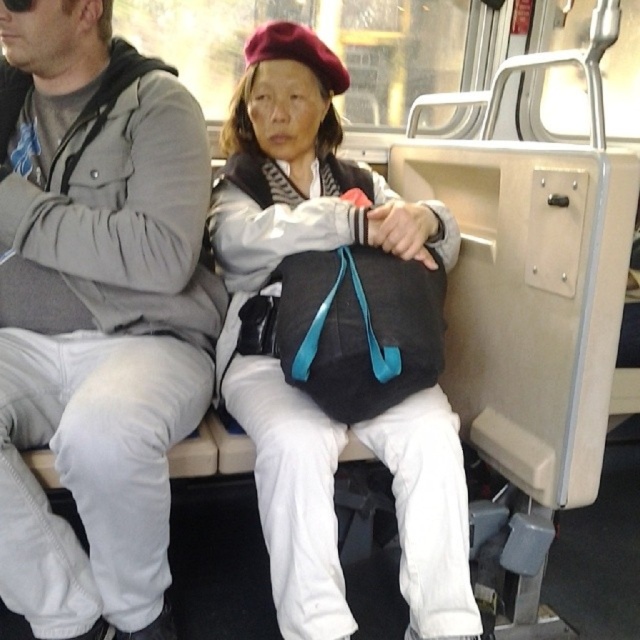
You are a delivery person who needs to place a small package between the gray cotton hoodie at left and the matte black bag at center. Which object should you place it closer to to ensure it fits?

The gray cotton hoodie at left is smaller than the matte black bag at center, so placing the small package closer to the gray cotton hoodie at left would ensure it fits better.

You are standing in front of the bus seats and want to reach two points marked on the seats. The first point is at coordinates point (35, 8) and the second is at point (282, 189). Which point should you reach first without moving your position?

Point (35, 8) is closer to the viewer than point (282, 189), so you should reach point (35, 8) first.

You are standing 3.77 feet away from the gray cotton hoodie at left. If you want to hand something to the person wearing it, can you reach them without moving closer?

The gray cotton hoodie at left is 3.77 feet away from the viewer. The average human arm length is about 2.5 feet, so you would need to move closer to reach them.